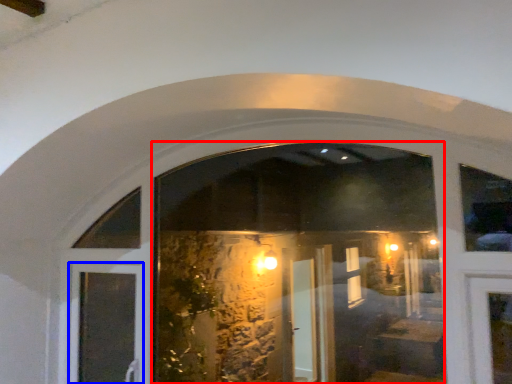
Question: Which of the following is the closest to the observer, shop window (highlighted by a red box) or door (highlighted by a blue box)?

Choices:
 (A) shop window
 (B) door

Answer: (A)